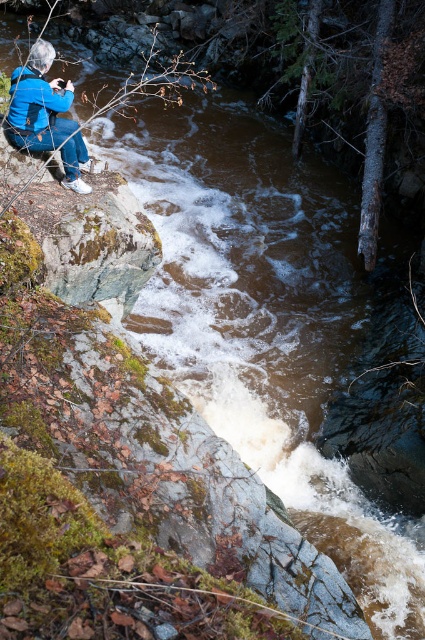
You are analyzing the composition of a photograph. The subject is a person sitting on rocks near a stream. Where is the blue fabric jacket at upper left positioned in terms of coordinates?

The blue fabric jacket at upper left is positioned at coordinates point (x=45, y=115).

Consider the image. You are a photographer trying to capture the person in the scene. Which jacket, the blue fabric jacket at upper left or the blue matte jacket at upper left, is closer to the camera?

The blue fabric jacket at upper left is in front of the blue matte jacket at upper left, so the blue fabric jacket at upper left is closer to the camera.

You are a photographer trying to decide which jacket to wear for a shoot in a forested area. You see the blue fabric jacket at upper left and the blue matte jacket at upper left in the image. Based on their sizes, which one is more suitable if you want a jacket that covers your body more?

The blue fabric jacket at upper left is larger in width than the blue matte jacket at upper left, making it more suitable for coverage.